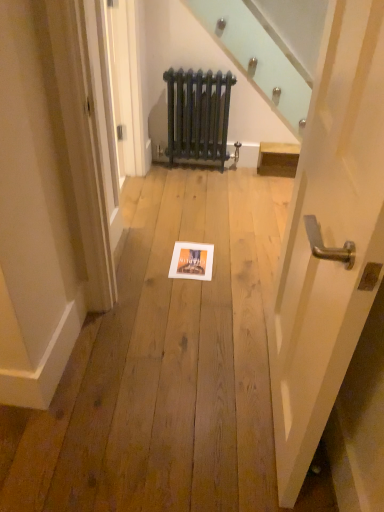
Question: Can you confirm if dark blue cast iron radiator at center is bigger than matte white picture frame at center?

Choices:
 (A) no
 (B) yes

Answer: (B)

Question: Considering the relative sizes of dark blue cast iron radiator at center and matte white picture frame at center in the image provided, is dark blue cast iron radiator at center wider than matte white picture frame at center?

Choices:
 (A) no
 (B) yes

Answer: (A)

Question: From the image's perspective, would you say dark blue cast iron radiator at center is positioned over matte white picture frame at center?

Choices:
 (A) no
 (B) yes

Answer: (B)

Question: Does dark blue cast iron radiator at center have a lesser width compared to matte white picture frame at center?

Choices:
 (A) yes
 (B) no

Answer: (A)

Question: Considering the relative sizes of dark blue cast iron radiator at center and matte white picture frame at center in the image provided, is dark blue cast iron radiator at center shorter than matte white picture frame at center?

Choices:
 (A) no
 (B) yes

Answer: (A)

Question: Is white glossy door handle at center right spatially inside dark blue cast iron radiator at center, or outside of it?

Choices:
 (A) inside
 (B) outside

Answer: (B)

Question: From a real-world perspective, is white glossy door handle at center right positioned above or below dark blue cast iron radiator at center?

Choices:
 (A) below
 (B) above

Answer: (B)

Question: Relative to dark blue cast iron radiator at center, is white glossy door handle at center right in front or behind?

Choices:
 (A) front
 (B) behind

Answer: (A)

Question: Does point (342, 164) appear closer or farther from the camera than point (210, 84)?

Choices:
 (A) closer
 (B) farther

Answer: (A)

Question: Considering the positions of white glossy door handle at center right and matte white picture frame at center in the image, is white glossy door handle at center right wider or thinner than matte white picture frame at center?

Choices:
 (A) thin
 (B) wide

Answer: (A)

Question: From a real-world perspective, is white glossy door handle at center right above or below matte white picture frame at center?

Choices:
 (A) below
 (B) above

Answer: (B)

Question: Considering the positions of white glossy door handle at center right and matte white picture frame at center in the image, is white glossy door handle at center right taller or shorter than matte white picture frame at center?

Choices:
 (A) tall
 (B) short

Answer: (A)

Question: From the image's perspective, is white glossy door handle at center right above or below matte white picture frame at center?

Choices:
 (A) below
 (B) above

Answer: (B)

Question: From the image's perspective, is matte white picture frame at center located above or below dark blue cast iron radiator at center?

Choices:
 (A) below
 (B) above

Answer: (A)

Question: Looking at the image, does matte white picture frame at center seem bigger or smaller compared to dark blue cast iron radiator at center?

Choices:
 (A) small
 (B) big

Answer: (A)